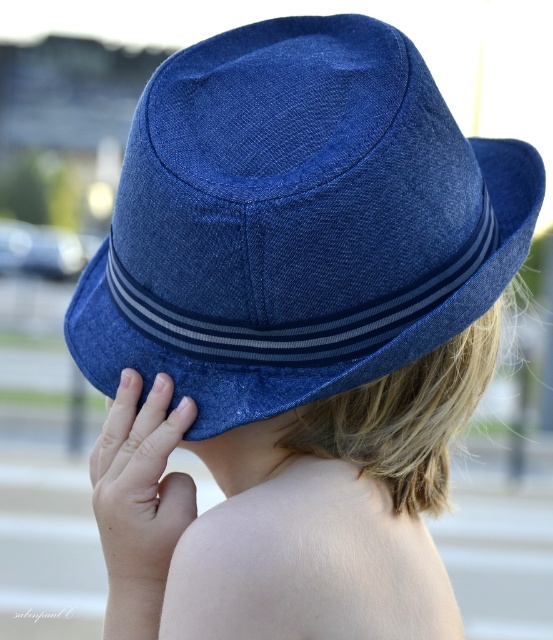
From the picture: Who is more forward, (466, 148) or (153, 576)?

Point (153, 576) is more forward.

Is denim blue fedora at back shorter than matte blue hat at upper center?

No.

Does point (388, 200) come closer to viewer compared to point (90, 474)?

That is True.

In order to click on denim blue fedora at back in this screenshot , I will do `click(296, 221)`.